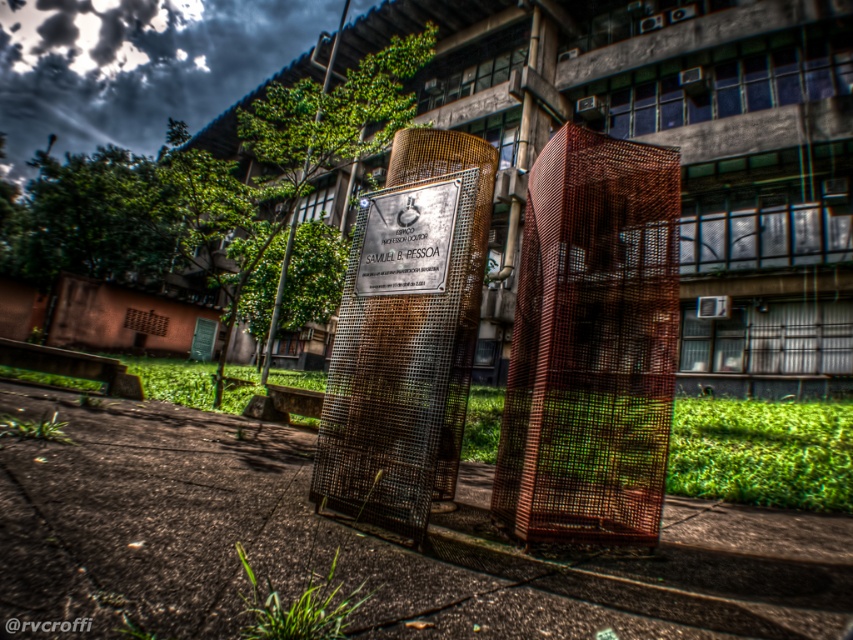
You are a maintenance worker inspecting the cylindrical structures in the urban scene. You notice the rusty wire mesh at center and the rusty mesh cage at center. Which object is located below the other?

The rusty wire mesh at center is positioned under the rusty mesh cage at center, so the rusty wire mesh at center is below the rusty mesh cage at center.

You are standing in front of the modern building and want to touch both the rusty wire mesh at center and the rusty mesh cage at center. Which one can you reach first without moving your feet?

You can reach the rusty wire mesh at center first because it is closer to you than the rusty mesh cage at center, which is further away.